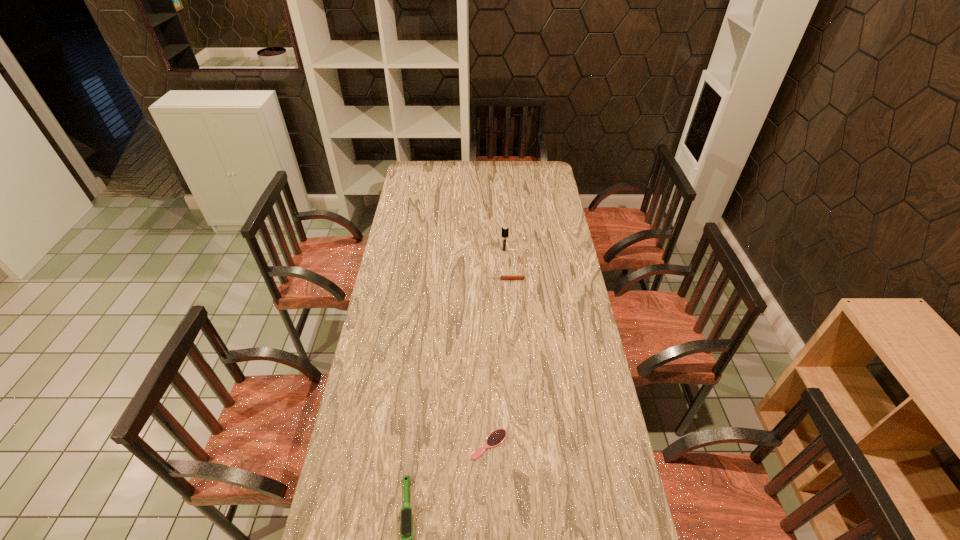
This screenshot has height=540, width=960. What are the coordinates of `free spot at the left edge of the desktop` in the screenshot? It's located at (390, 331).

Locate an element on the screen. This screenshot has height=540, width=960. free space at the right edge of the desktop is located at coordinates (535, 185).

Where is `vacant space at the far right corner of the desktop`? Image resolution: width=960 pixels, height=540 pixels. vacant space at the far right corner of the desktop is located at coordinates (536, 165).

Locate an element on the screen. The width and height of the screenshot is (960, 540). vacant region between the second nearest hairbrush and the farthest hairbrush is located at coordinates (496, 347).

Find the location of a particular element. The height and width of the screenshot is (540, 960). free space that is in between the second nearest hairbrush and the second shortest object is located at coordinates (498, 362).

Identify the location of free spot between the second hairbrush from left to right and the sausage. (498, 362).

The height and width of the screenshot is (540, 960). Identify the location of blank region between the second hairbrush from left to right and the farthest object. (496, 347).

Locate an element on the screen. empty space that is in between the third tallest object and the shortest object is located at coordinates (498, 362).

At what (x,y) coordinates should I click in order to perform the action: click on free space between the third nearest object and the farthest object. Please return your answer as a coordinate pair (x, y). Looking at the image, I should click on (505, 265).

Find the location of a particular element. The height and width of the screenshot is (540, 960). unoccupied position between the third farthest object and the farthest hairbrush is located at coordinates (496, 347).